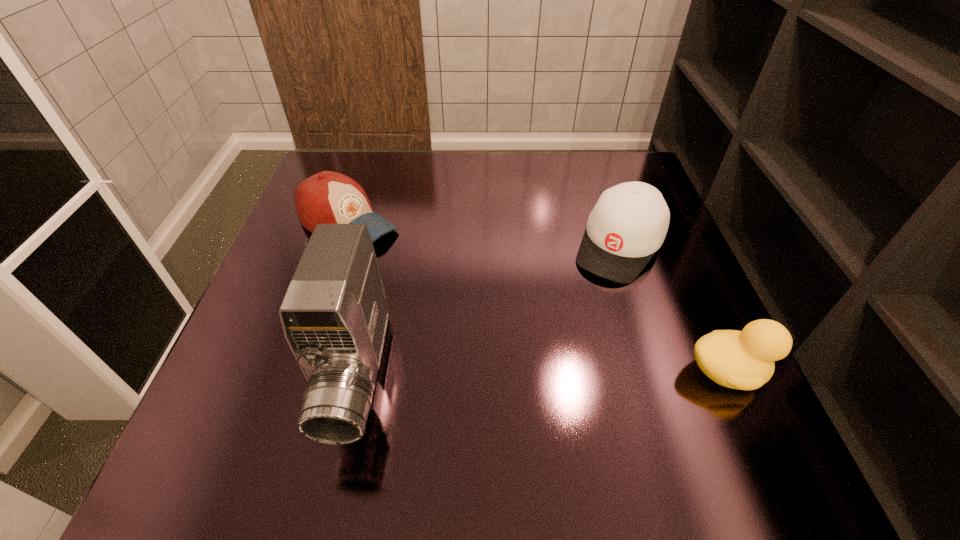
Locate an element on the screen. This screenshot has width=960, height=540. free space on the desktop that is between the tallest object and the duck and is positioned on the front-facing side of the left baseball cap is located at coordinates (592, 374).

Find the location of a particular element. vacant space on the desktop that is between the tallest object and the duck and is positioned on the front-facing side of the right baseball cap is located at coordinates (540, 374).